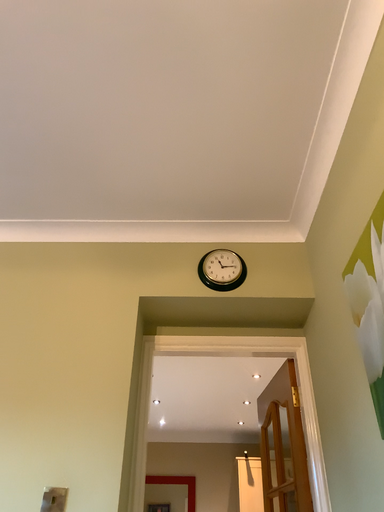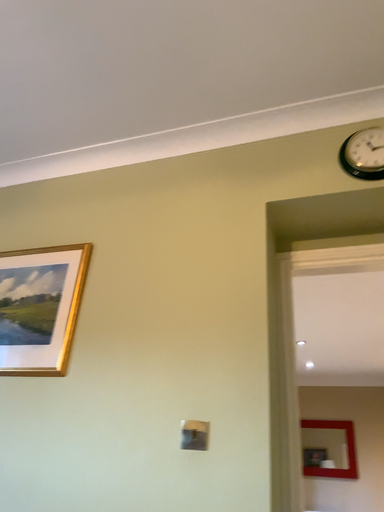
Question: How did the camera likely rotate when shooting the video?

Choices:
 (A) rotated left
 (B) rotated right

Answer: (A)